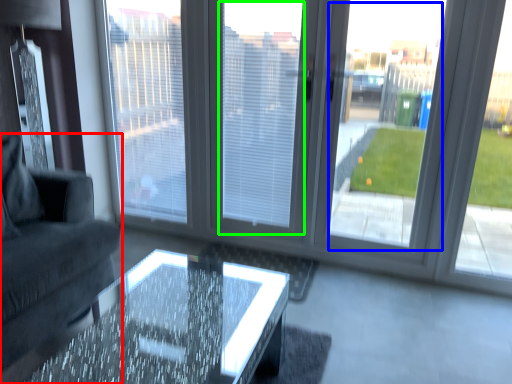
Question: Considering the real-world distances, which object is closest to studio couch (highlighted by a red box)? window screen (highlighted by a blue box) or window screen (highlighted by a green box).

Choices:
 (A) window screen
 (B) window screen

Answer: (B)